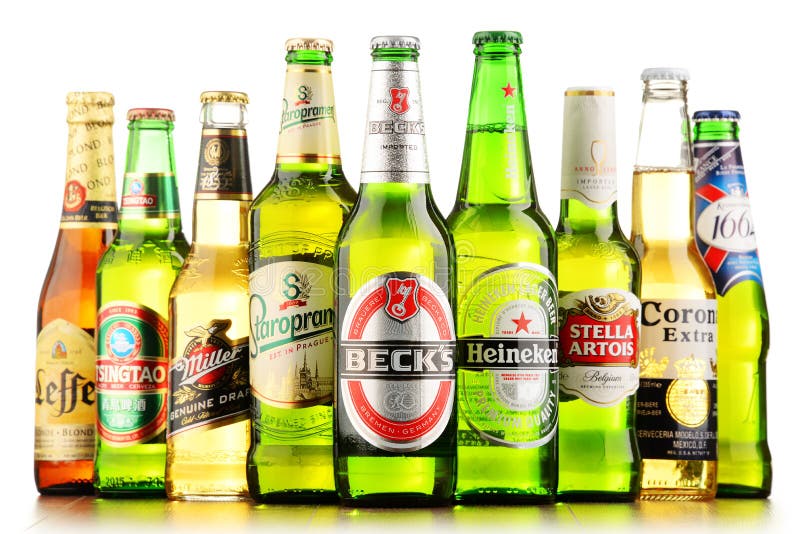
Where is `bottles`? bottles is located at coordinates (746, 345), (677, 347), (616, 337), (506, 333), (390, 339), (306, 316), (226, 304), (142, 281), (82, 282).